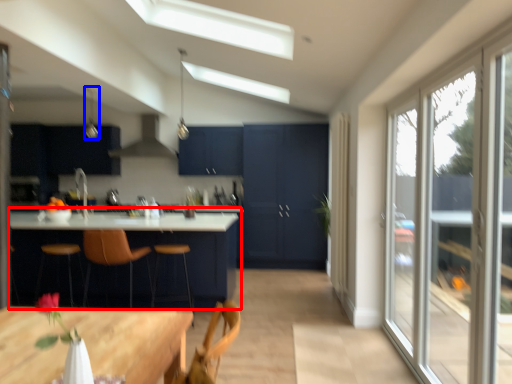
Question: Among these objects, which one is farthest to the camera, table (highlighted by a red box) or light fixture (highlighted by a blue box)?

Choices:
 (A) table
 (B) light fixture

Answer: (B)